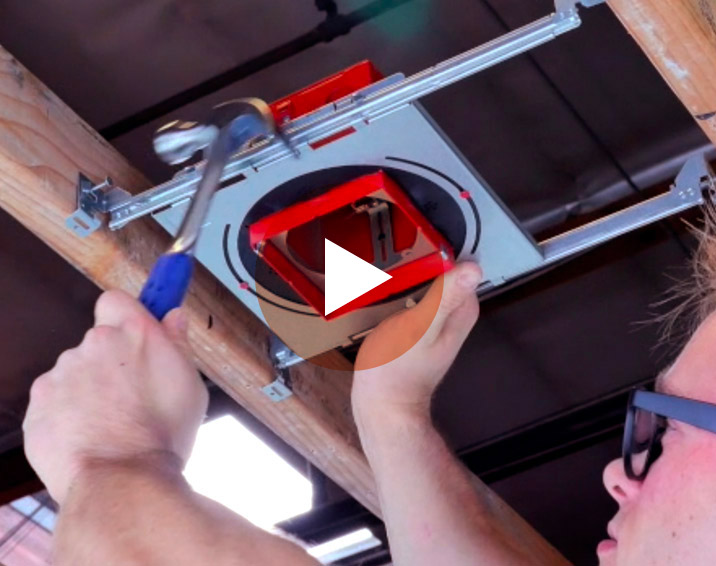
This screenshot has height=566, width=716. What are the coordinates of `wood board` in the screenshot? It's located at (696, 51), (48, 192).